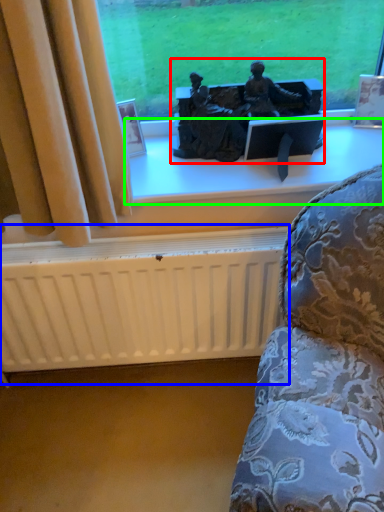
Question: Estimate the real-world distances between objects in this image. Which object is farther from sculpture (highlighted by a red box), radiator (highlighted by a blue box) or window sill (highlighted by a green box)?

Choices:
 (A) radiator
 (B) window sill

Answer: (A)